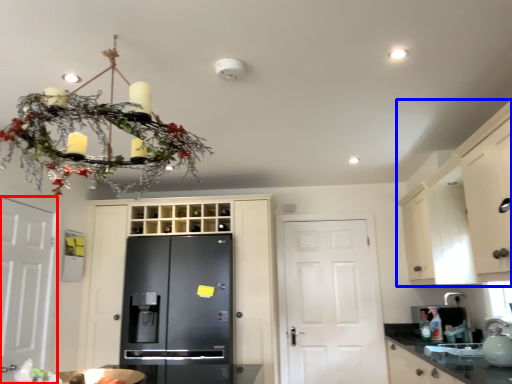
Question: Which point is closer to the camera, door (highlighted by a red box) or cabinetry (highlighted by a blue box)?

Choices:
 (A) door
 (B) cabinetry

Answer: (B)